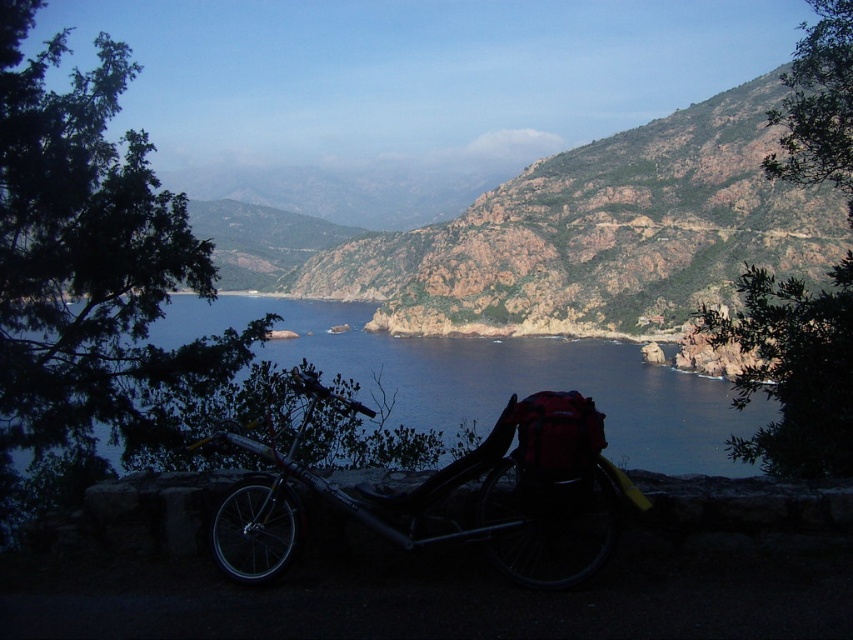
Which is below, silver metallic mountain bike at lower center or blue water at center?

silver metallic mountain bike at lower center

Does silver metallic mountain bike at lower center have a greater width compared to blue water at center?

No, silver metallic mountain bike at lower center is not wider than blue water at center.

Who is more distant from viewer, (577,508) or (589,371)?

Point (589,371)

Identify the location of silver metallic mountain bike at lower center. (450, 492).

Does rustic rock cliff at center have a smaller size compared to silver metallic mountain bike at lower center?

Actually, rustic rock cliff at center might be larger than silver metallic mountain bike at lower center.

Which of these two, rustic rock cliff at center or silver metallic mountain bike at lower center, stands taller?

rustic rock cliff at center

Find the location of a particular element. The width and height of the screenshot is (853, 640). rustic rock cliff at center is located at coordinates (599, 234).

Identify the location of rustic rock cliff at center. The image size is (853, 640). (599, 234).

Does point (409, 262) come farther from viewer compared to point (376, 344)?

Yes, it is behind point (376, 344).

Between rustic rock cliff at center and blue water at center, which one has less height?

With less height is blue water at center.

This screenshot has width=853, height=640. Find the location of `rustic rock cliff at center`. rustic rock cliff at center is located at coordinates (599, 234).